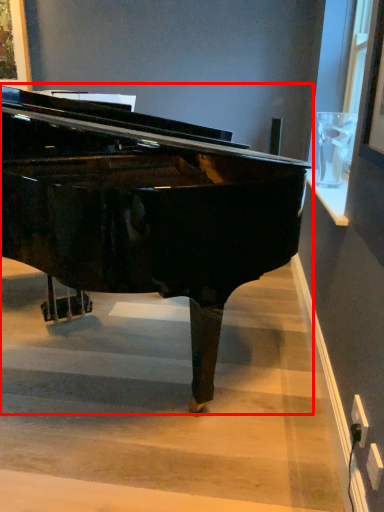
Question: Where is piano (annotated by the red box) located in relation to stairwell in the image?

Choices:
 (A) left
 (B) right

Answer: (A)